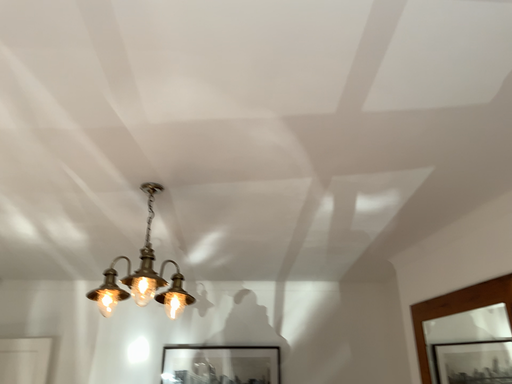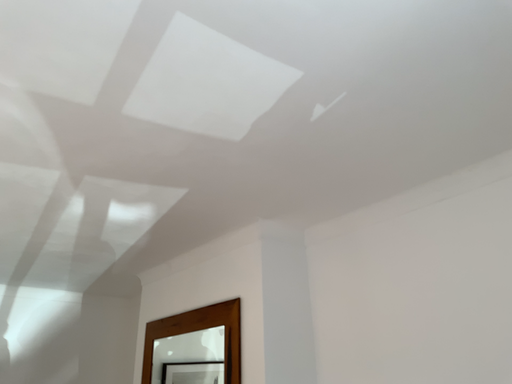
Question: Which way did the camera rotate in the video?

Choices:
 (A) rotated left
 (B) rotated right

Answer: (B)